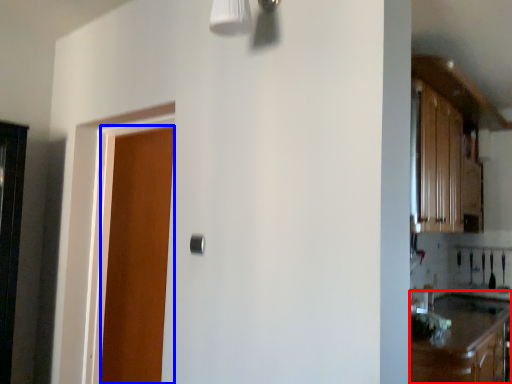
Question: Which object is further to the camera taking this photo, cabinetry (highlighted by a red box) or door (highlighted by a blue box)?

Choices:
 (A) cabinetry
 (B) door

Answer: (B)